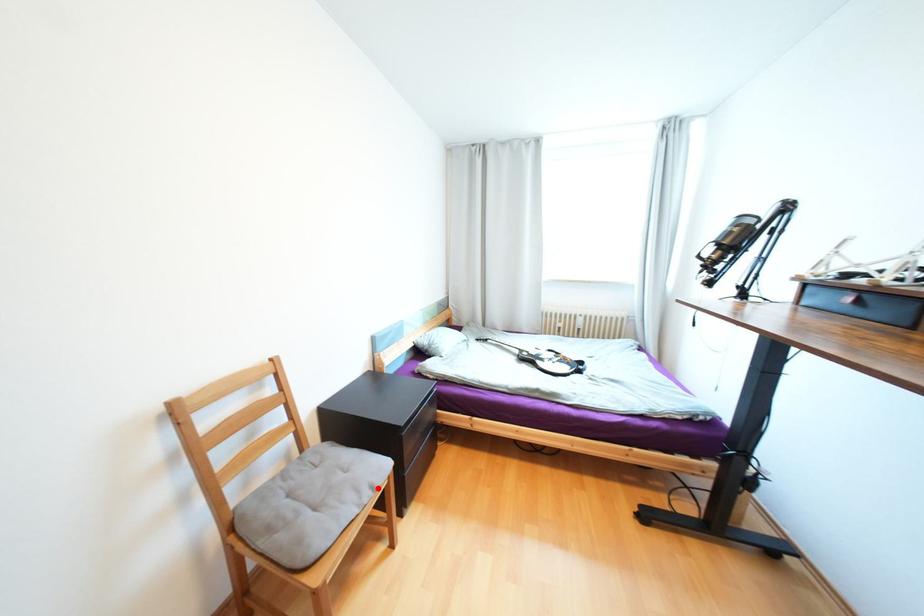
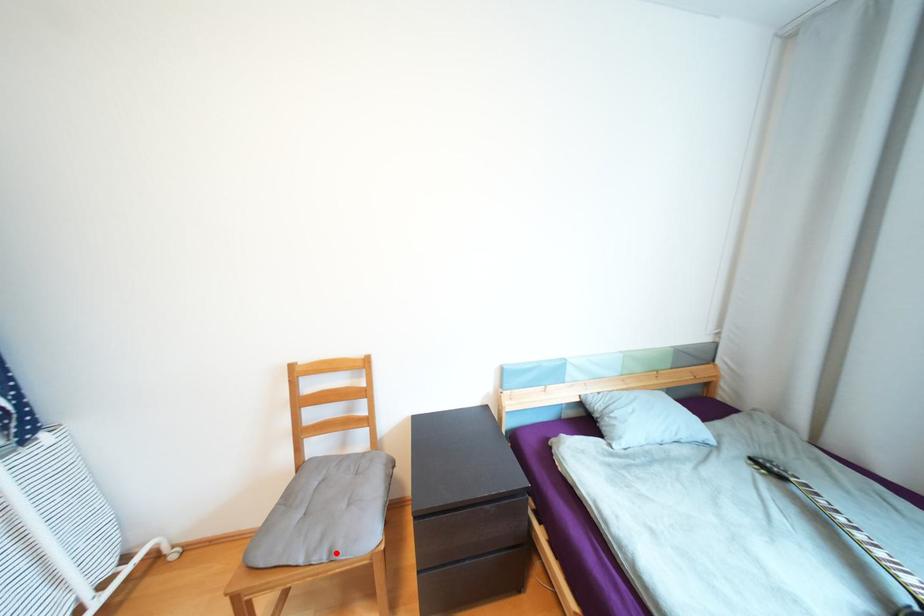
I am providing you with two images of the same scene from different viewpoints. A red point is marked on the first image and another point is marked on the second image. Is the marked point in image1 the same physical position as the marked point in image2?

Yes